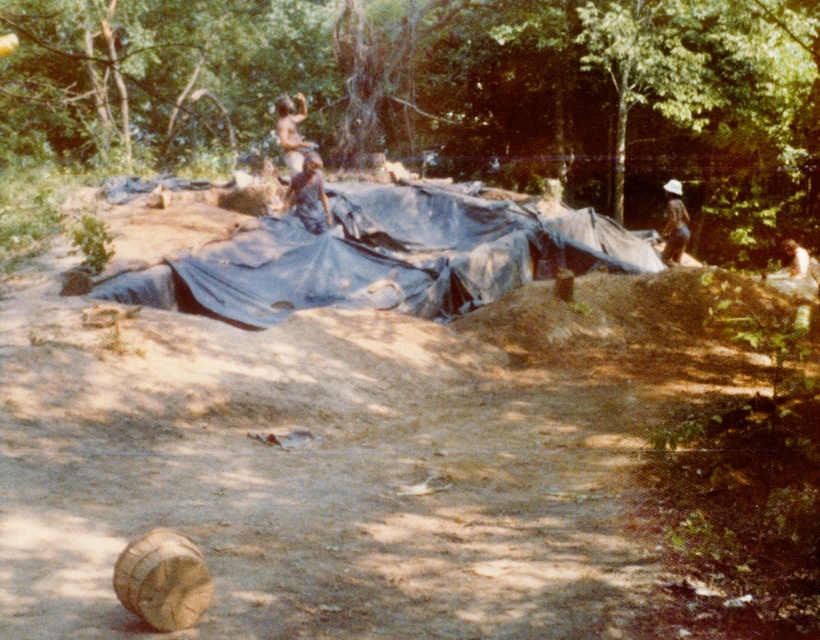
Question: Does brown sandy dirt field at center come behind brown textured fabric at center?

Choices:
 (A) yes
 (B) no

Answer: (B)

Question: Can you confirm if brown sandy dirt field at center is wider than brown fabric hat at upper right?

Choices:
 (A) yes
 (B) no

Answer: (A)

Question: Which object is closer to the camera taking this photo?

Choices:
 (A) brown sandy dirt field at center
 (B) brown fabric hat at upper right
 (C) brown skin person at upper center
 (D) brown textured fabric at center

Answer: (A)

Question: Estimate the real-world distances between objects in this image. Which object is farther from the brown fabric hat at upper right?

Choices:
 (A) brown skin person at upper center
 (B) brown textured fabric at center
 (C) brown sandy dirt field at center

Answer: (C)

Question: Is brown sandy dirt field at center to the right of brown textured fabric at center from the viewer's perspective?

Choices:
 (A) no
 (B) yes

Answer: (B)

Question: Among these points, which one is nearest to the camera?

Choices:
 (A) (281, 97)
 (B) (531, 602)
 (C) (308, 204)
 (D) (673, 228)

Answer: (B)